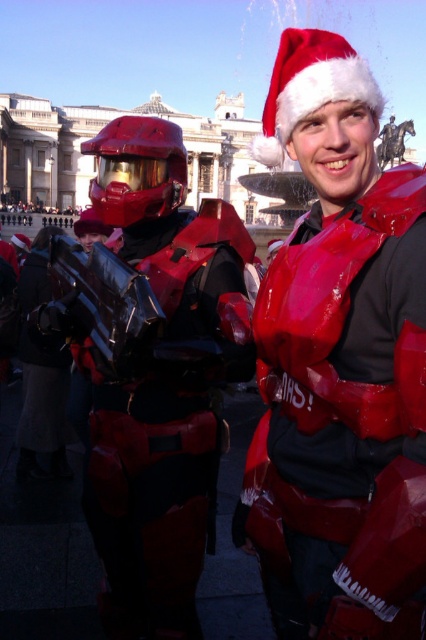
Can you confirm if shiny plastic santa hat at upper center is smaller than glossy red armor at center?

Actually, shiny plastic santa hat at upper center might be larger than glossy red armor at center.

Which of these two, shiny plastic santa hat at upper center or glossy red armor at center, stands taller?

shiny plastic santa hat at upper center

Between point (414, 548) and point (158, 625), which one is positioned behind?

The point (158, 625) is behind.

Identify the location of shiny plastic santa hat at upper center. (339, 364).